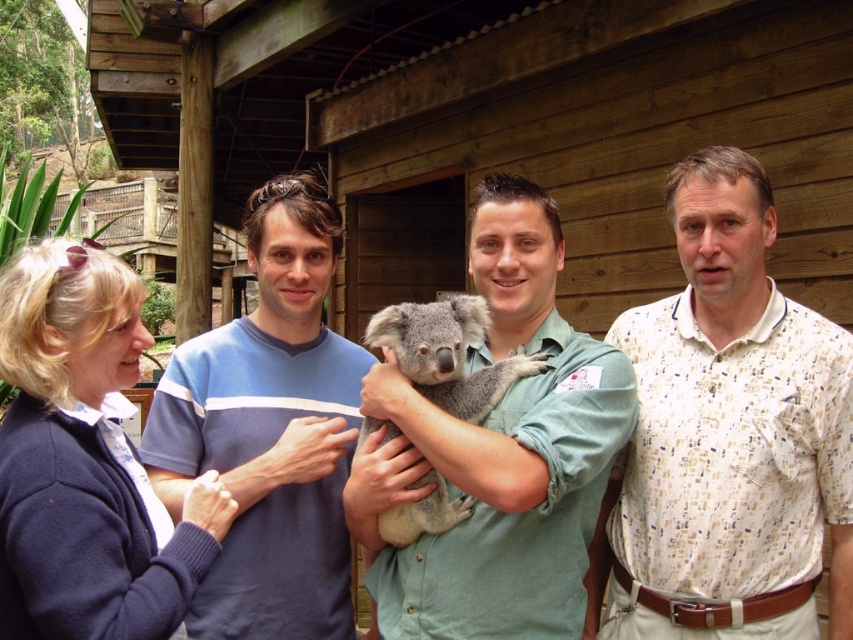
Who is lower down, white printed shirt at right or navy blue sweater at lower left?

white printed shirt at right is lower down.

Does white printed shirt at right have a greater height compared to navy blue sweater at lower left?

Correct, white printed shirt at right is much taller as navy blue sweater at lower left.

Locate an element on the screen. This screenshot has height=640, width=853. white printed shirt at right is located at coordinates (727, 436).

Can you confirm if green shirt at center is shorter than blue cotton sweater at center?

Yes.

Can you confirm if green shirt at center is wider than blue cotton sweater at center?

Indeed, green shirt at center has a greater width compared to blue cotton sweater at center.

Identify the location of green shirt at center. (498, 452).

The width and height of the screenshot is (853, 640). Identify the location of green shirt at center. (498, 452).

Describe the element at coordinates (727, 436) in the screenshot. I see `white printed shirt at right` at that location.

Is point (799, 396) in front of point (454, 509)?

No, it is behind (454, 509).

Does point (811, 536) lie in front of point (395, 326)?

No, (811, 536) is further to viewer.

Identify the location of white printed shirt at right. The height and width of the screenshot is (640, 853). (727, 436).